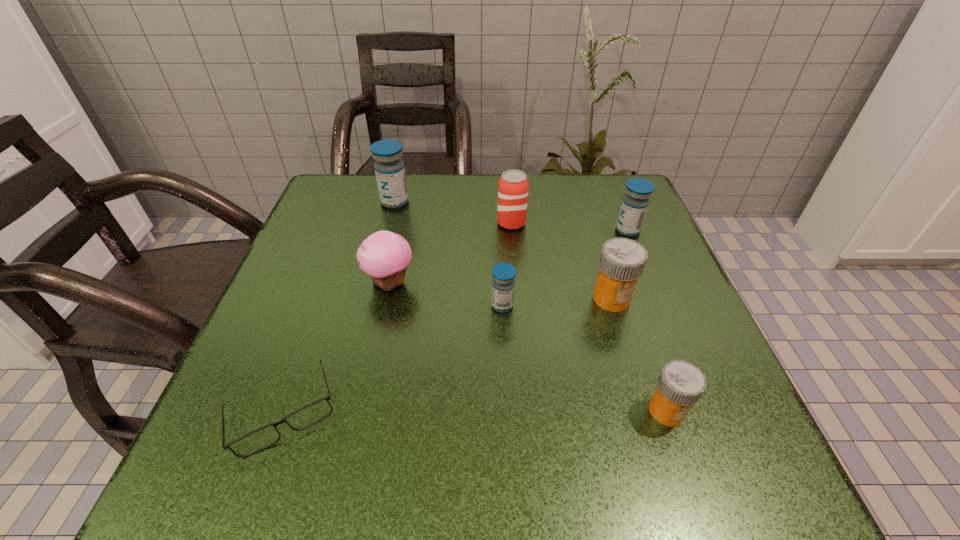
In the image, there is a desktop. Where is `free space at the far left corner`? This screenshot has height=540, width=960. free space at the far left corner is located at coordinates (359, 191).

Find the location of `vacant region between the nearer orange medicine and the fourth nearest medicine`. vacant region between the nearer orange medicine and the fourth nearest medicine is located at coordinates (647, 321).

At what (x,y) coordinates should I click in order to perform the action: click on free space between the pink cupcake and the smallest blue medicine. Please return your answer as a coordinate pair (x, y). Looking at the image, I should click on (445, 294).

You are a GUI agent. You are given a task and a screenshot of the screen. Output one action in this format:
    pyautogui.click(x=<x>, y=<y>)
    Task: Click on the free space between the tallest medicine and the nearest blue medicine
    Image resolution: width=960 pixels, height=540 pixels.
    Given the screenshot: What is the action you would take?
    pyautogui.click(x=448, y=254)

Where is `empty location between the pink cupcake and the second blue medicine from left to right`? The width and height of the screenshot is (960, 540). empty location between the pink cupcake and the second blue medicine from left to right is located at coordinates (445, 294).

I want to click on free space between the nearer orange medicine and the cupcake, so [528, 347].

You are a GUI agent. You are given a task and a screenshot of the screen. Output one action in this format:
    pyautogui.click(x=<x>, y=<y>)
    Task: Click on the vacant area that lies between the cupcake and the second blue medicine from right to left
    This screenshot has height=540, width=960.
    Given the screenshot: What is the action you would take?
    pyautogui.click(x=445, y=294)

Locate an element on the screen. The height and width of the screenshot is (540, 960). vacant space that's between the nearest blue medicine and the nearer orange medicine is located at coordinates (585, 358).

I want to click on empty location between the leftmost blue medicine and the farther orange medicine, so click(x=503, y=251).

Where is `empty space between the orange beer can and the pink cupcake`? Image resolution: width=960 pixels, height=540 pixels. empty space between the orange beer can and the pink cupcake is located at coordinates (450, 253).